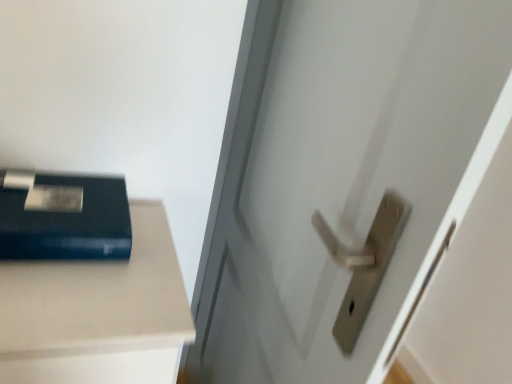
Question: From a real-world perspective, is satin silver handle at center positioned above or below matte black book at upper left?

Choices:
 (A) above
 (B) below

Answer: (B)

Question: Looking at their shapes, would you say satin silver handle at center is wider or thinner than matte black book at upper left?

Choices:
 (A) wide
 (B) thin

Answer: (B)

Question: Which is correct: satin silver handle at center is inside matte black book at upper left, or outside of it?

Choices:
 (A) outside
 (B) inside

Answer: (A)

Question: Considering the positions of matte black book at upper left and satin silver handle at center in the image, is matte black book at upper left wider or thinner than satin silver handle at center?

Choices:
 (A) wide
 (B) thin

Answer: (A)

Question: Is point (17, 243) positioned closer to the camera than point (298, 64)?

Choices:
 (A) farther
 (B) closer

Answer: (B)

Question: Is matte black book at upper left situated inside satin silver handle at center or outside?

Choices:
 (A) outside
 (B) inside

Answer: (A)

Question: In the image, is matte black book at upper left positioned in front of or behind satin silver handle at center?

Choices:
 (A) front
 (B) behind

Answer: (B)